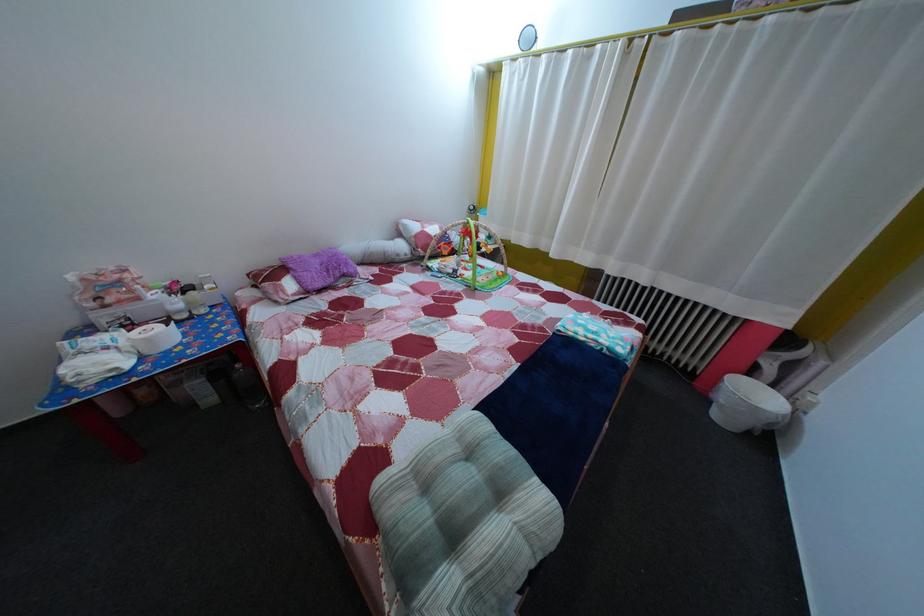
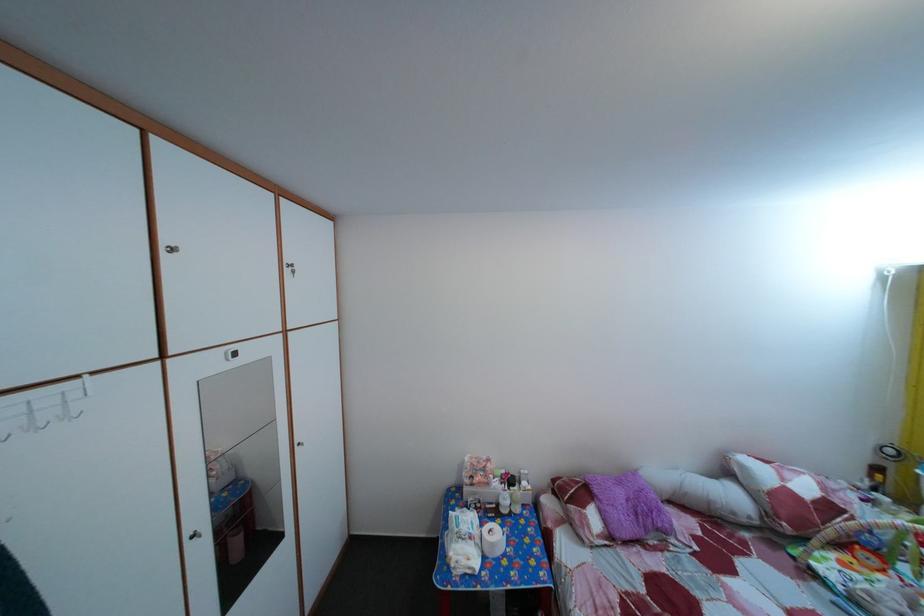
In the second image, find the point that corresponds to point (325, 262) in the first image.

(629, 491)